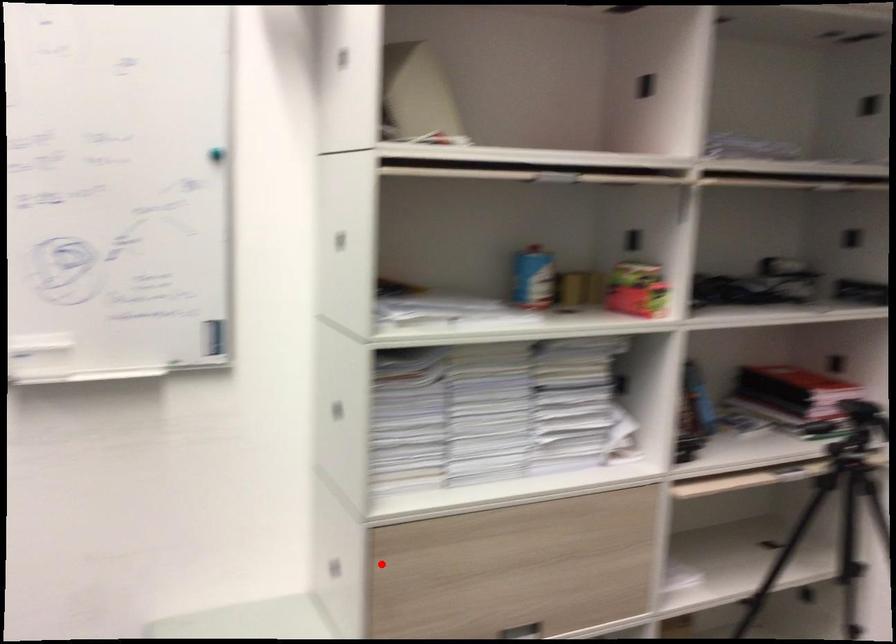
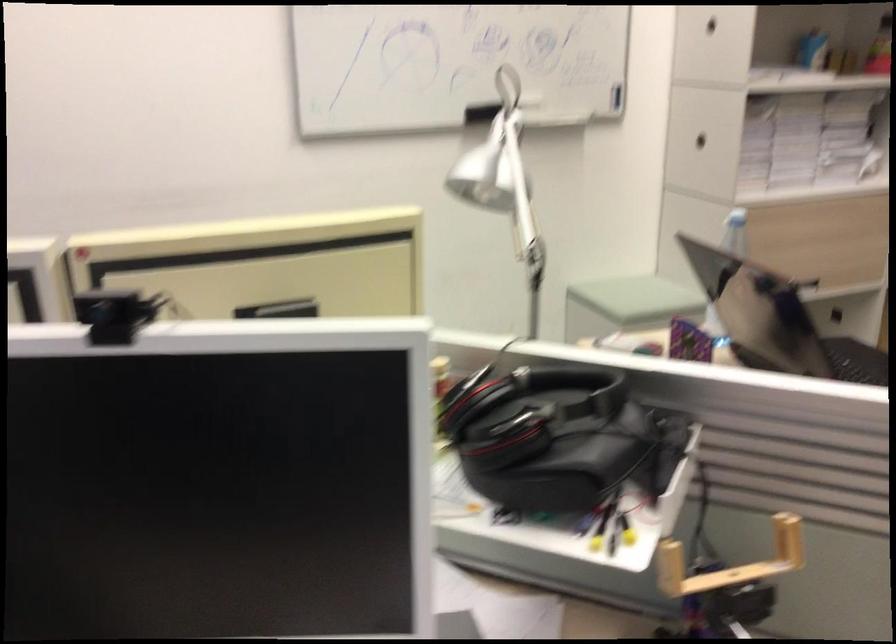
Question: I am providing you with two images of the same scene from different viewpoints. A red point is shown in image1. For the corresponding object point in image2, is it positioned nearer or farther from the camera?

Choices:
 (A) Nearer
 (B) Farther

Answer: (B)